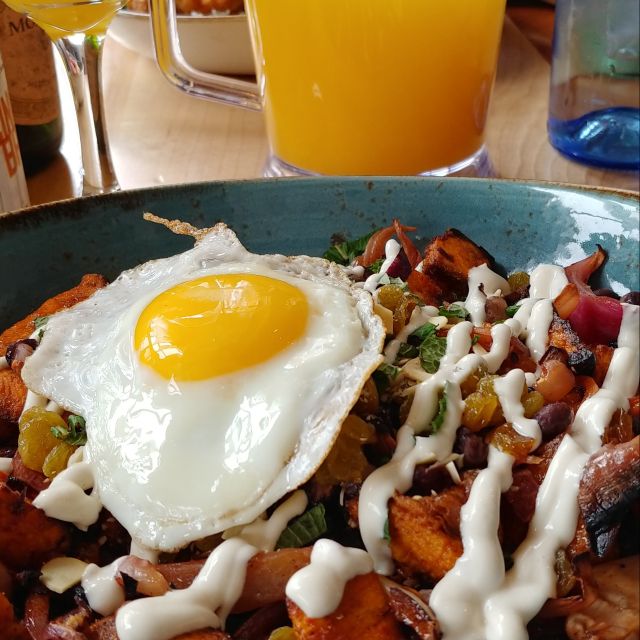
What are the coordinates of `stoneware plate` in the screenshot? It's located at (275, 205).